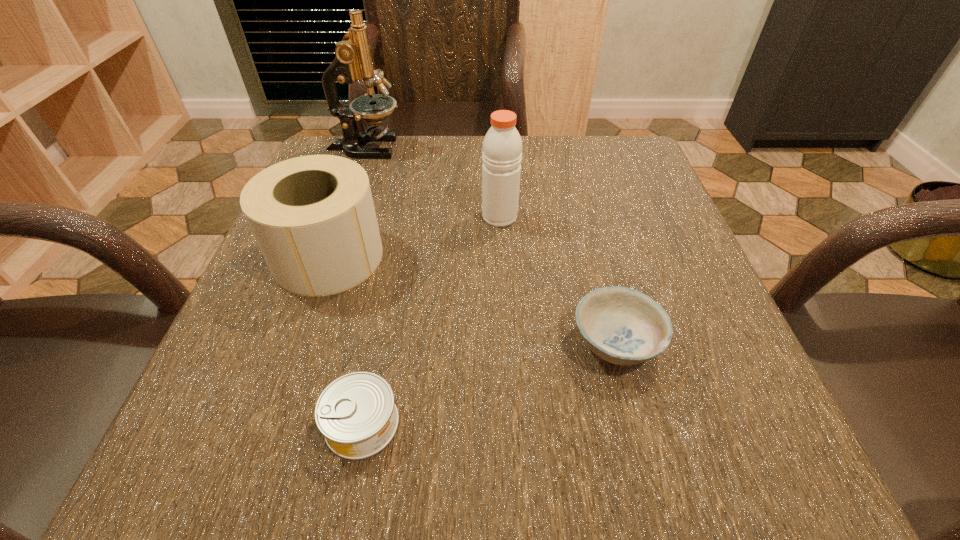
This screenshot has width=960, height=540. In the image, there is a desktop. Identify the location of free region at the left edge. (266, 271).

Where is `free space at the right edge`? free space at the right edge is located at coordinates [654, 238].

Locate an element on the screen. Image resolution: width=960 pixels, height=540 pixels. free spot at the far left corner of the desktop is located at coordinates (380, 144).

In the image, there is a desktop. At what (x,y) coordinates should I click in order to perform the action: click on vacant space at the far right corner. Please return your answer as a coordinate pair (x, y). The width and height of the screenshot is (960, 540). Looking at the image, I should click on (579, 147).

Image resolution: width=960 pixels, height=540 pixels. In order to click on unoccupied position between the farthest object and the rightmost object in this screenshot , I will do `click(491, 245)`.

At what (x,y) coordinates should I click in order to perform the action: click on vacant region between the rightmost object and the nearest object. Please return your answer as a coordinate pair (x, y). This screenshot has width=960, height=540. Looking at the image, I should click on (489, 383).

Where is `vacant area that lies between the shaker and the microscope`? This screenshot has height=540, width=960. vacant area that lies between the shaker and the microscope is located at coordinates (433, 182).

This screenshot has height=540, width=960. I want to click on free space between the second object from right to left and the can, so click(431, 320).

You are a GUI agent. You are given a task and a screenshot of the screen. Output one action in this format:
    pyautogui.click(x=<x>, y=<y>)
    Task: Click on the vacant space in between the nearest object and the toilet tissue
    The width and height of the screenshot is (960, 540).
    Given the screenshot: What is the action you would take?
    pyautogui.click(x=346, y=340)

The width and height of the screenshot is (960, 540). Find the location of `vacant area between the second nearest object and the nearest object`. vacant area between the second nearest object and the nearest object is located at coordinates (489, 383).